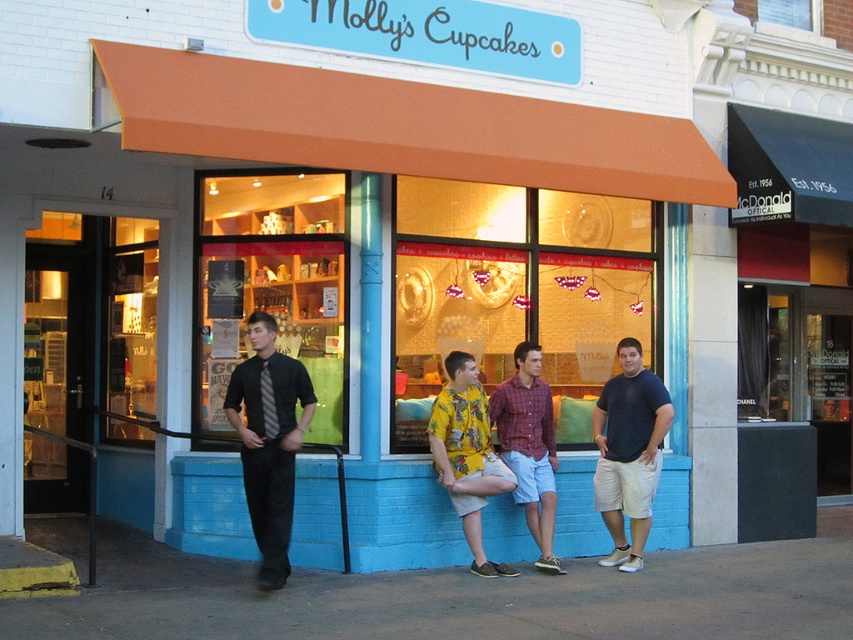
Who is taller, matte blue t-shirt at center or plaid cotton shirt at center?

Standing taller between the two is matte blue t-shirt at center.

Can you confirm if matte blue t-shirt at center is taller than plaid cotton shirt at center?

Indeed, matte blue t-shirt at center has a greater height compared to plaid cotton shirt at center.

Locate an element on the screen. The image size is (853, 640). matte blue t-shirt at center is located at coordinates (628, 451).

Who is lower down, matte black shirt at left or matte blue t-shirt at center?

Positioned lower is matte blue t-shirt at center.

Looking at this image, can you confirm if matte black shirt at left is wider than matte blue t-shirt at center?

Yes, matte black shirt at left is wider than matte blue t-shirt at center.

Find the location of a particular element. matte black shirt at left is located at coordinates (270, 440).

I want to click on matte black shirt at left, so click(x=270, y=440).

Measure the distance from yellow printed shirt at center to plaid cotton shirt at center.

A distance of 16.51 inches exists between yellow printed shirt at center and plaid cotton shirt at center.

Who is more distant from viewer, (x=490, y=572) or (x=527, y=416)?

The point (x=527, y=416) is more distant.

What are the coordinates of `yellow printed shirt at center` in the screenshot? It's located at (467, 454).